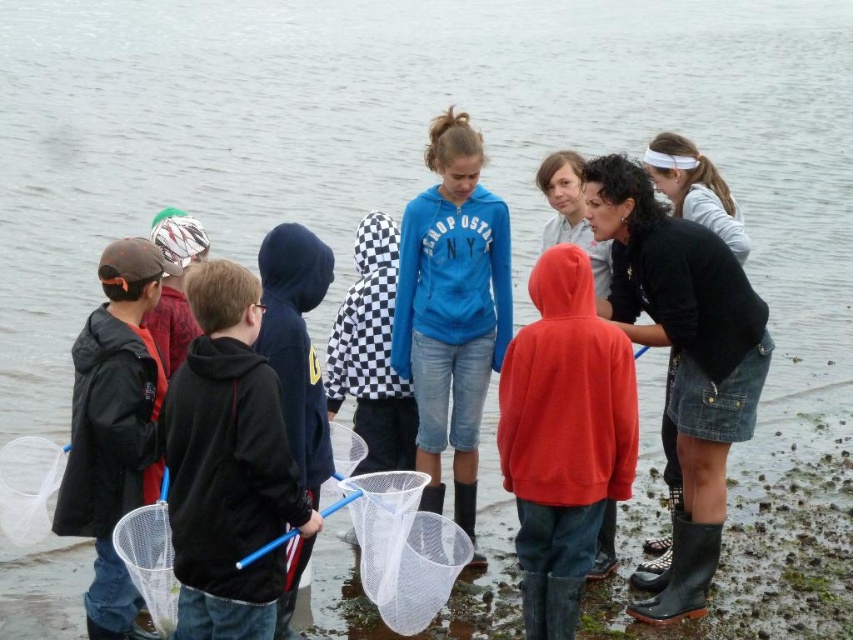
Question: Is matte blue hoodie at center above white mesh fishing net at lower center?

Choices:
 (A) yes
 (B) no

Answer: (A)

Question: Is matte blue hoodie at center above white mesh fishing net at lower center?

Choices:
 (A) no
 (B) yes

Answer: (B)

Question: Is black fleece jacket at center closer to camera compared to matte blue hoodie at center?

Choices:
 (A) yes
 (B) no

Answer: (A)

Question: Which of the following is the closest to the observer?

Choices:
 (A) matte black jacket at left
 (B) matte blue hoodie at center
 (C) matte red hoodie at center
 (D) white mesh fishing net at lower center

Answer: (A)

Question: Which point is closer to the camera?

Choices:
 (A) matte red hoodie at center
 (B) white mesh fishing net at lower center
 (C) matte blue hoodie at center

Answer: (B)

Question: Estimate the real-world distances between objects in this image. Which object is closer to the matte blue hoodie at center?

Choices:
 (A) white mesh fishing net at lower center
 (B) matte red hoodie at center
 (C) matte black jacket at left

Answer: (B)